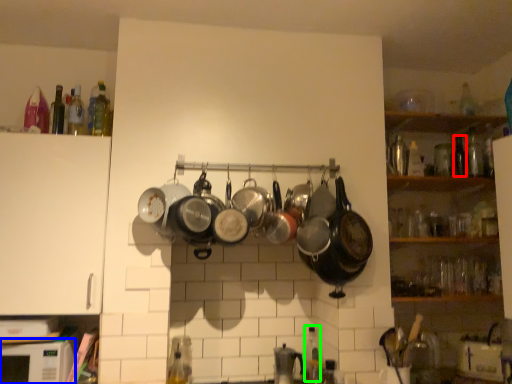
Question: Which object is the farthest from bottle (highlighted by a red box)? Choose among these: microwave (highlighted by a blue box) or bottle (highlighted by a green box).

Choices:
 (A) microwave
 (B) bottle

Answer: (A)